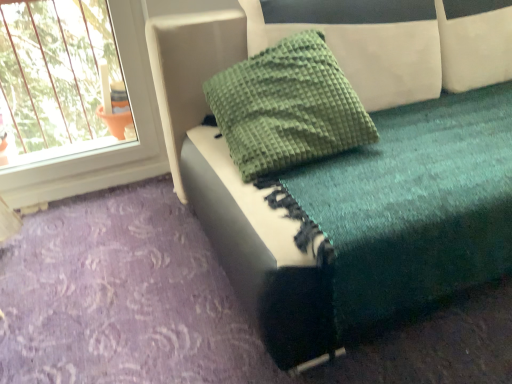
What do you see at coordinates (330, 203) in the screenshot? I see `teal fabric cushion at upper center` at bounding box center [330, 203].

Locate an element on the screen. teal fabric cushion at upper center is located at coordinates (330, 203).

Image resolution: width=512 pixels, height=384 pixels. Describe the element at coordinates (287, 107) in the screenshot. I see `green textured pillow at upper center` at that location.

Identify the location of green textured pillow at upper center. (287, 107).

Identify the location of teal fabric cushion at upper center. This screenshot has height=384, width=512. 330,203.

Which is more to the left, green textured pillow at upper center or teal fabric cushion at upper center?

From the viewer's perspective, green textured pillow at upper center appears more on the left side.

Relative to teal fabric cushion at upper center, is green textured pillow at upper center in front or behind?

Visually, green textured pillow at upper center is located behind teal fabric cushion at upper center.

Does point (343, 128) appear closer or farther from the camera than point (293, 238)?

Point (343, 128) is positioned farther from the camera compared to point (293, 238).

From the image's perspective, which one is positioned higher, green textured pillow at upper center or teal fabric cushion at upper center?

From the image's view, teal fabric cushion at upper center is above.

From a real-world perspective, which object rests below the other?

teal fabric cushion at upper center is physically lower.

Looking at their sizes, would you say green textured pillow at upper center is wider or thinner than teal fabric cushion at upper center?

Clearly, green textured pillow at upper center has less width compared to teal fabric cushion at upper center.

Between green textured pillow at upper center and teal fabric cushion at upper center, which one has more height?

Standing taller between the two is teal fabric cushion at upper center.

Which of these two, green textured pillow at upper center or teal fabric cushion at upper center, is bigger?

teal fabric cushion at upper center is bigger.

Is teal fabric cushion at upper center located within green textured pillow at upper center?

Definitely not — teal fabric cushion at upper center is not inside green textured pillow at upper center.

Is there a large distance between green textured pillow at upper center and teal fabric cushion at upper center?

No, green textured pillow at upper center is not far from teal fabric cushion at upper center.

Is green textured pillow at upper center positioned with its back to teal fabric cushion at upper center?

Yes, green textured pillow at upper center's orientation is away from teal fabric cushion at upper center.

What are the coordinates of `pillow that appears below the teal fabric cushion at upper center (from the image's perspective)` in the screenshot? It's located at (287, 107).

Can you confirm if teal fabric cushion at upper center is positioned to the left of green textured pillow at upper center?

Incorrect, teal fabric cushion at upper center is not on the left side of green textured pillow at upper center.

Which is behind, teal fabric cushion at upper center or green textured pillow at upper center?

green textured pillow at upper center is further from the camera.

Between point (471, 217) and point (290, 114), which one is positioned in front?

Point (471, 217)

From the image's perspective, between teal fabric cushion at upper center and green textured pillow at upper center, who is located below?

green textured pillow at upper center is shown below in the image.

From a real-world perspective, which object rests below the other?

teal fabric cushion at upper center.

In terms of width, does teal fabric cushion at upper center look wider or thinner when compared to green textured pillow at upper center?

Considering their sizes, teal fabric cushion at upper center looks broader than green textured pillow at upper center.

Which of these two, teal fabric cushion at upper center or green textured pillow at upper center, stands shorter?

With less height is green textured pillow at upper center.

Who is bigger, teal fabric cushion at upper center or green textured pillow at upper center?

With larger size is teal fabric cushion at upper center.

Is teal fabric cushion at upper center surrounding green textured pillow at upper center?

Yes, green textured pillow at upper center is surrounded by teal fabric cushion at upper center.

Is there a large distance between teal fabric cushion at upper center and green textured pillow at upper center?

teal fabric cushion at upper center is near green textured pillow at upper center, not far away.

Is teal fabric cushion at upper center positioned with its back to green textured pillow at upper center?

That's right, teal fabric cushion at upper center is facing away from green textured pillow at upper center.

Can you tell me how much teal fabric cushion at upper center and green textured pillow at upper center differ in facing direction?

There is a 0.000284-degree angle between the facing directions of teal fabric cushion at upper center and green textured pillow at upper center.

This screenshot has height=384, width=512. Identify the location of furniture above the green textured pillow at upper center (from the image's perspective). (330, 203).

I want to click on pillow behind the teal fabric cushion at upper center, so click(x=287, y=107).

Identify the location of furniture in front of the green textured pillow at upper center. The height and width of the screenshot is (384, 512). (330, 203).